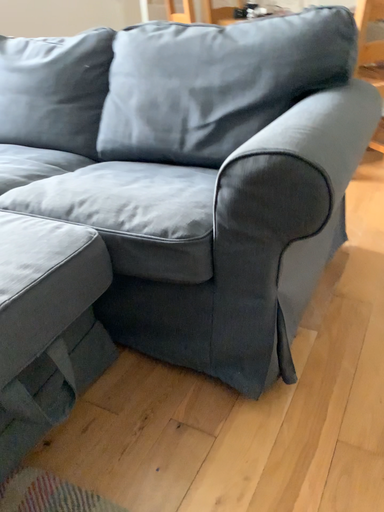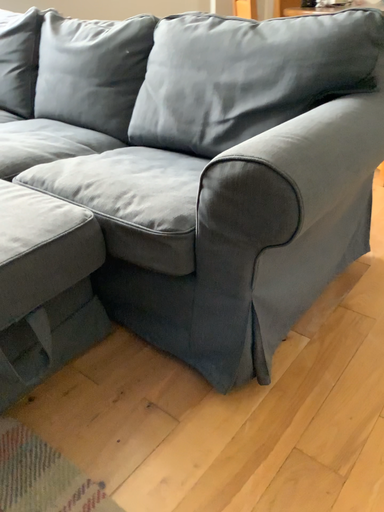
Question: How did the camera likely rotate when shooting the video?

Choices:
 (A) rotated right
 (B) rotated left

Answer: (B)